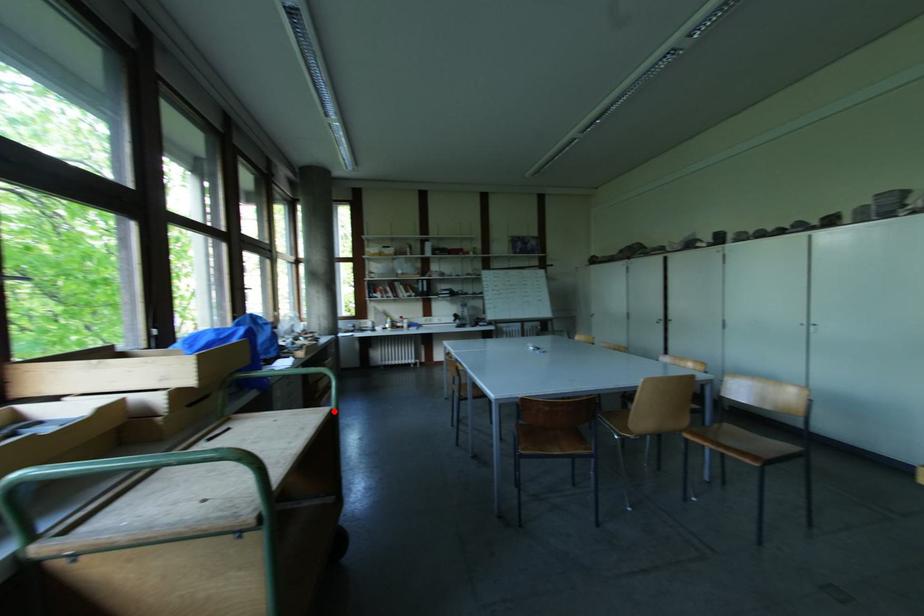
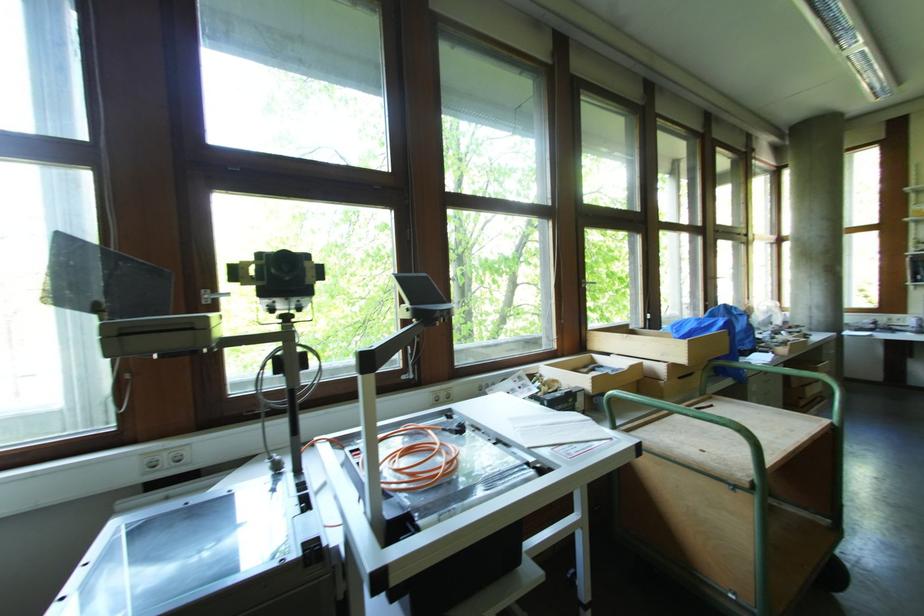
Question: I am providing you with two images of the same scene from different viewpoints. Given a red point in image1, look at the same physical point in image2. Is it:

Choices:
 (A) Closer to the viewpoint
 (B) Farther from the viewpoint

Answer: (A)